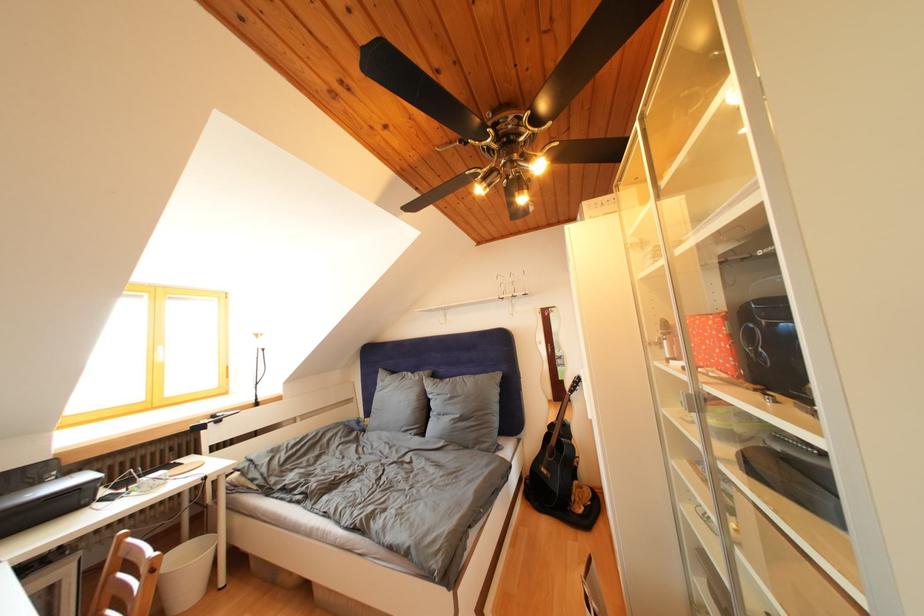
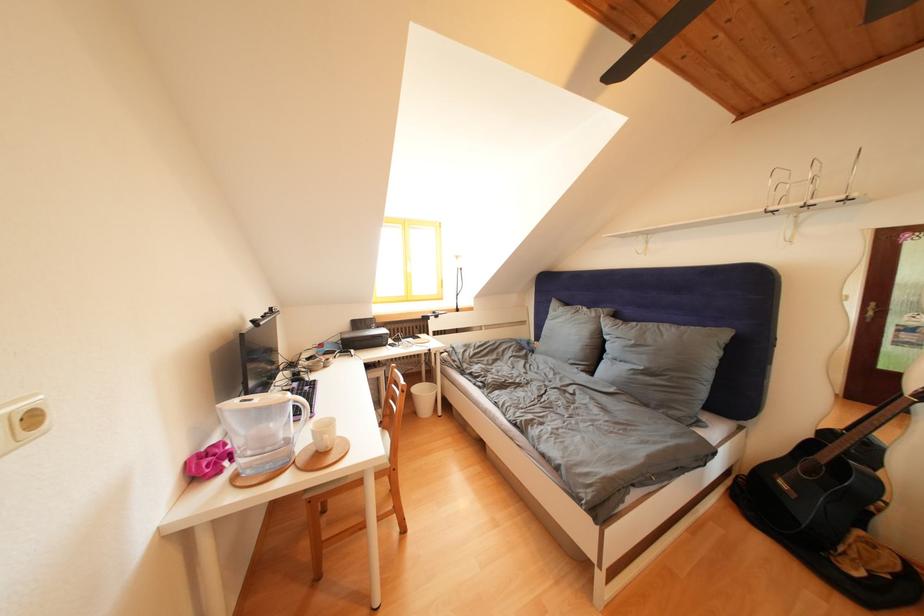
Find the pixel in the second image that matches (x=400, y=378) in the first image.

(575, 310)